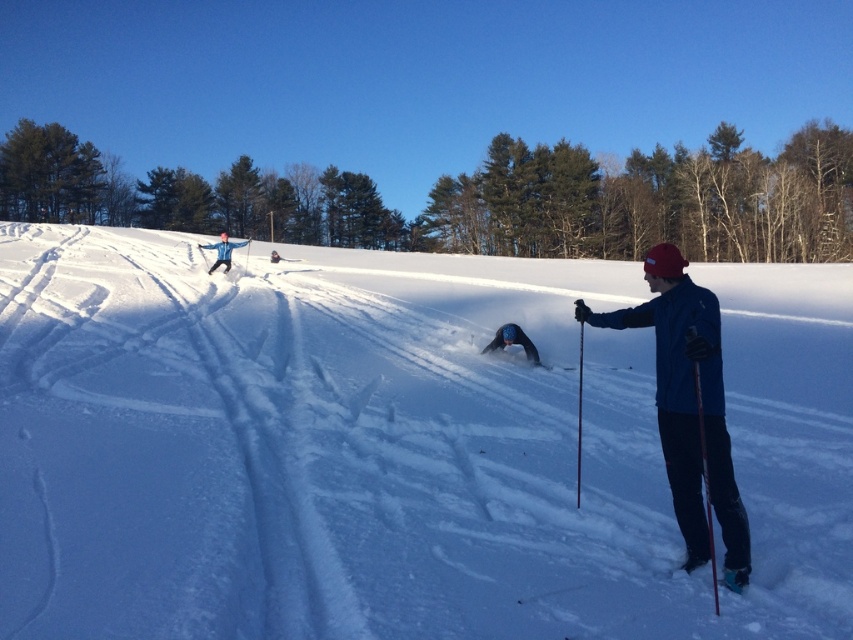
Does point (245, 413) come behind point (235, 244)?

No.

Is white fluffy snow at center taller than white snowboarder at upper left?

No, white fluffy snow at center is not taller than white snowboarder at upper left.

Where is `white fluffy snow at center`? This screenshot has width=853, height=640. white fluffy snow at center is located at coordinates (387, 452).

Between red plastic ski pole at right and dark blue jacket at upper left, which one appears on the left side from the viewer's perspective?

From the viewer's perspective, dark blue jacket at upper left appears more on the left side.

Which is in front, point (697, 392) or point (273, 260)?

Point (697, 392)

The image size is (853, 640). What are the coordinates of `red plastic ski pole at right` in the screenshot? It's located at (705, 483).

Find the location of a particular element. The width and height of the screenshot is (853, 640). red plastic ski pole at right is located at coordinates (705, 483).

Between point (691, 348) and point (222, 248), which one is positioned behind?

Point (222, 248)

Is point (682, 385) more distant than point (199, 246)?

No, (682, 385) is in front of (199, 246).

Between point (734, 500) and point (227, 257), which one is positioned in front?

Point (734, 500)

You are a GUI agent. You are given a task and a screenshot of the screen. Output one action in this format:
    pyautogui.click(x=<x>, y=<y>)
    Task: Click on the blue matte jacket at center
    
    Given the screenshot: What is the action you would take?
    tap(688, 406)